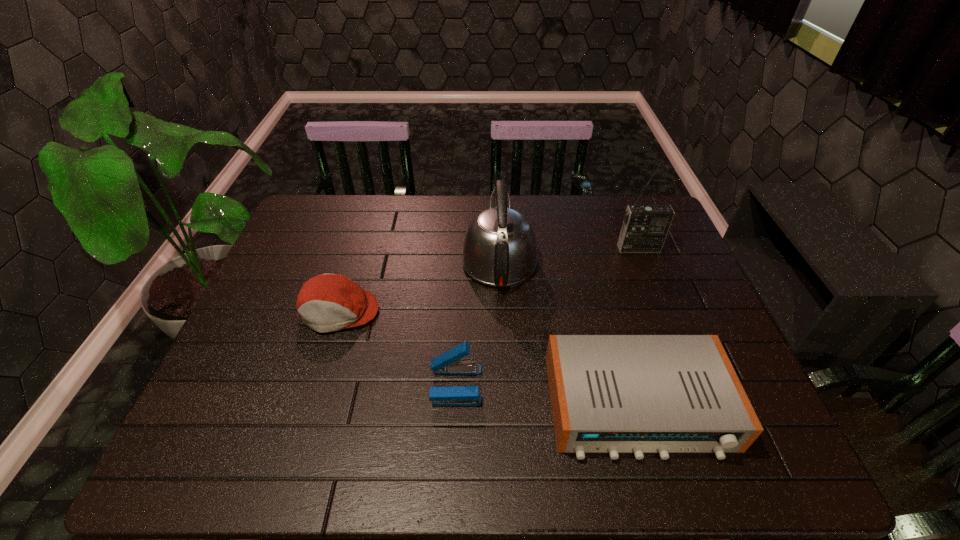
Locate an element on the screen. The height and width of the screenshot is (540, 960). blank space at the near left corner is located at coordinates (176, 472).

Find the location of a particular element. vacant region at the far right corner is located at coordinates (617, 220).

The width and height of the screenshot is (960, 540). In the image, there is a desktop. Identify the location of free region at the near right corner. (726, 467).

The image size is (960, 540). What are the coordinates of `free spot between the leftmost object and the fourth shortest object` in the screenshot? It's located at (420, 286).

Where is `vacant area that lies between the kettle and the farther radio receiver`? vacant area that lies between the kettle and the farther radio receiver is located at coordinates (569, 254).

This screenshot has width=960, height=540. What are the coordinates of `free area in between the tallest object and the kettle` in the screenshot? It's located at pos(569,254).

Identify the location of free space between the kettle and the taller radio receiver. The width and height of the screenshot is (960, 540). (569, 254).

At what (x,y) coordinates should I click in order to perform the action: click on free space between the second tallest object and the farther radio receiver. Please return your answer as a coordinate pair (x, y). This screenshot has height=540, width=960. Looking at the image, I should click on (569, 254).

Find the location of `empty space that is in between the stapler and the tallest object`. empty space that is in between the stapler and the tallest object is located at coordinates (547, 316).

This screenshot has height=540, width=960. I want to click on free space between the stapler and the tallest object, so click(x=547, y=316).